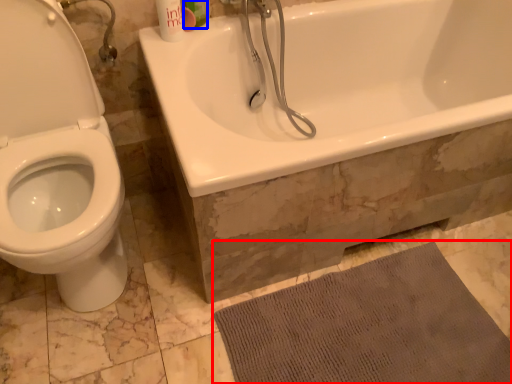
Question: Among these objects, which one is farthest to the camera, bath mat (highlighted by a red box) or mouthwash (highlighted by a blue box)?

Choices:
 (A) bath mat
 (B) mouthwash

Answer: (B)